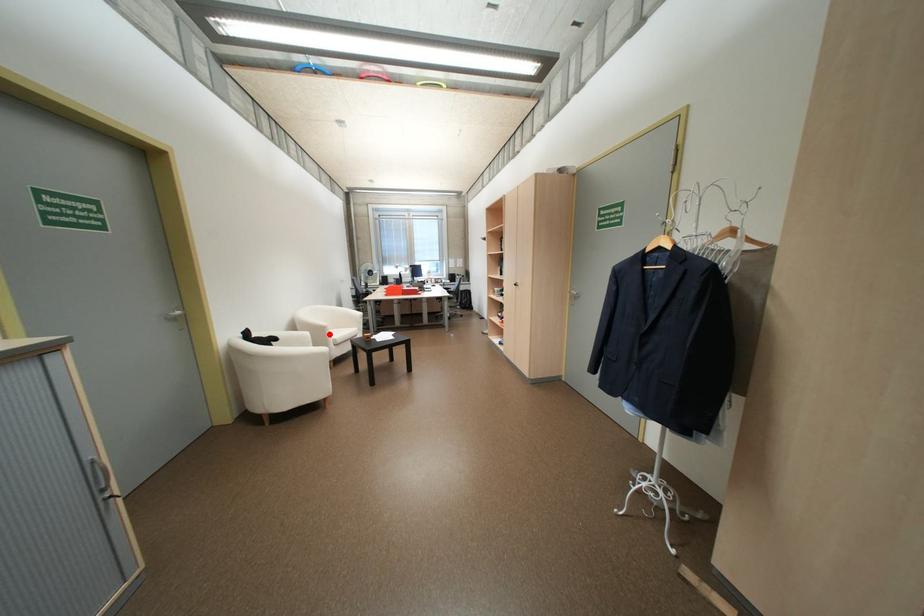
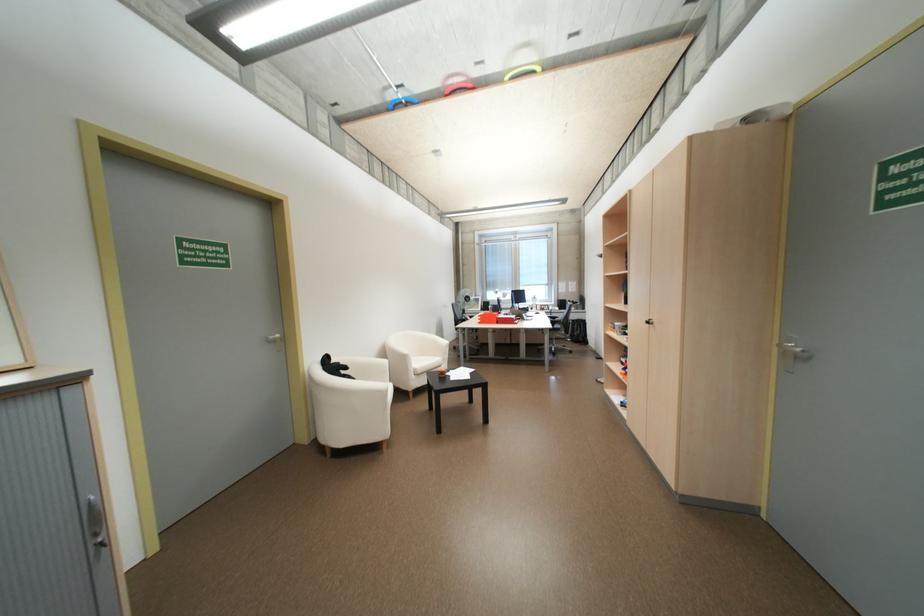
In the second image, find the point that corresponds to the highlighted location in the first image.

(408, 363)